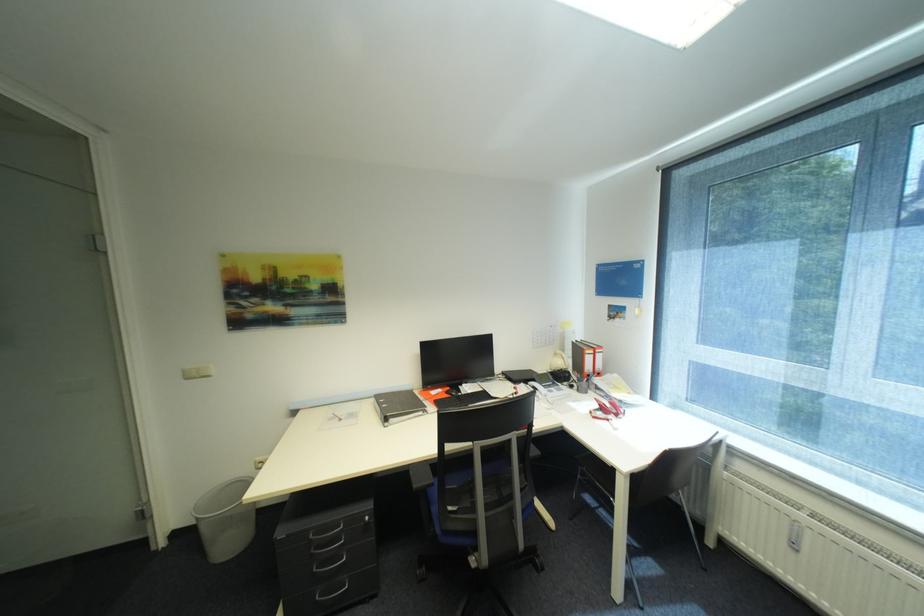
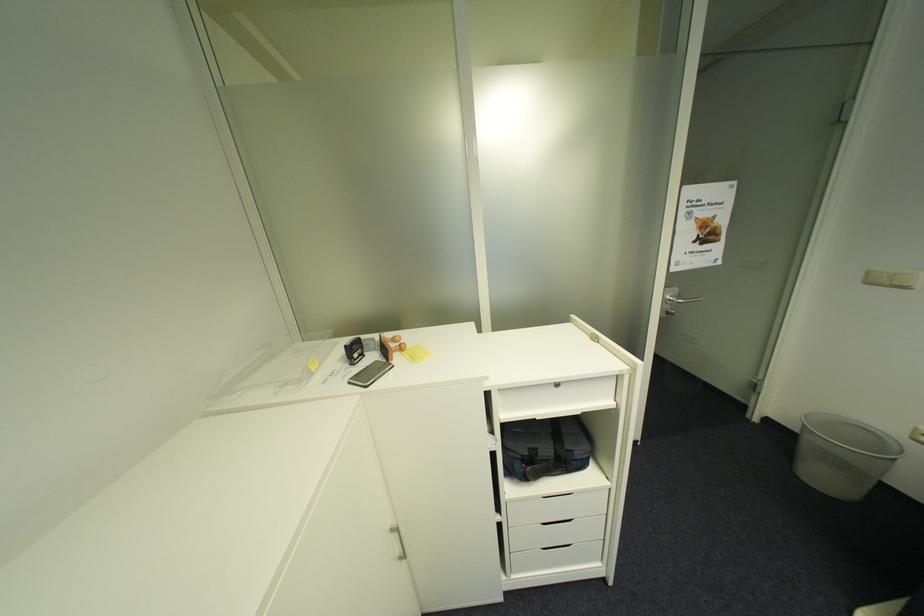
Where in the second image is the point corresponding to the point at 205,377 from the first image?

(895, 285)